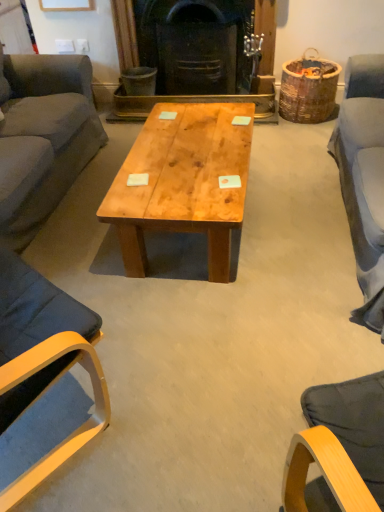
What do you see at coordinates (183, 182) in the screenshot? This screenshot has height=512, width=384. I see `natural wood coffee table at center` at bounding box center [183, 182].

You are a GUI agent. You are given a task and a screenshot of the screen. Output one action in this format:
    pyautogui.click(x=<x>, y=<y>)
    Task: Click on the dark gray fabric couch at left
    
    Given the screenshot: What is the action you would take?
    pyautogui.click(x=43, y=139)

Where is `matte wood chair at left`? The image size is (384, 512). matte wood chair at left is located at coordinates (43, 359).

What is the approximate height of black cast iron fireplace at center?

The height of black cast iron fireplace at center is 32.20 inches.

Identify the location of natural wood coffee table at center. (183, 182).

From the image's perspective, which object appears higher, matte wood chair at left or black cast iron fireplace at center?

black cast iron fireplace at center.

Which is in front, point (95, 370) or point (115, 110)?

The point (95, 370) is in front.

From their relative heights in the image, would you say matte wood chair at left is taller or shorter than black cast iron fireplace at center?

In the image, matte wood chair at left appears to be taller than black cast iron fireplace at center.

Is matte wood chair at left to the left or to the right of black cast iron fireplace at center in the image?

Based on their positions, matte wood chair at left is located to the left of black cast iron fireplace at center.

Can you see natural wood coffee table at center touching matte wood chair at left?

No, natural wood coffee table at center is not making contact with matte wood chair at left.

Does natural wood coffee table at center have a greater height compared to matte wood chair at left?

No, natural wood coffee table at center is not taller than matte wood chair at left.

Considering the sizes of objects natural wood coffee table at center and matte wood chair at left in the image provided, who is thinner, natural wood coffee table at center or matte wood chair at left?

matte wood chair at left is thinner.

Which object is positioned more to the right, matte wood chair at left or natural wood coffee table at center?

natural wood coffee table at center.

Is matte wood chair at left positioned with its back to natural wood coffee table at center?

No.

From the image's perspective, is matte wood chair at left on top of natural wood coffee table at center?

No, from the image's perspective, matte wood chair at left is not on top of natural wood coffee table at center.

Based on the photo, is matte wood chair at left beside natural wood coffee table at center?

No, matte wood chair at left is not making contact with natural wood coffee table at center.

Who is smaller, natural wood coffee table at center or black cast iron fireplace at center?

With smaller size is black cast iron fireplace at center.

From a real-world perspective, which object stands above the other?

black cast iron fireplace at center is physically above.

How much distance is there between natural wood coffee table at center and black cast iron fireplace at center?

natural wood coffee table at center and black cast iron fireplace at center are 4.10 feet apart.

Is natural wood coffee table at center to the right of black cast iron fireplace at center from the viewer's perspective?

No.

From the picture: From a real-world perspective, who is located lower, dark gray fabric couch at left or black cast iron fireplace at center?

black cast iron fireplace at center.

Considering the relative sizes of dark gray fabric couch at left and black cast iron fireplace at center in the image provided, is dark gray fabric couch at left taller than black cast iron fireplace at center?

Indeed, dark gray fabric couch at left has a greater height compared to black cast iron fireplace at center.

Considering the relative positions of dark gray fabric couch at left and black cast iron fireplace at center in the image provided, is dark gray fabric couch at left to the left of black cast iron fireplace at center from the viewer's perspective?

Yes.

Could you tell me if dark gray fabric couch at left is facing natural wood coffee table at center?

Yes.

Is the position of dark gray fabric couch at left more distant than that of natural wood coffee table at center?

No, dark gray fabric couch at left is closer to the viewer.

Is point (65, 72) positioned after point (224, 243)?

Yes.

Considering the relative sizes of dark gray fabric couch at left and natural wood coffee table at center in the image provided, is dark gray fabric couch at left wider than natural wood coffee table at center?

Indeed, dark gray fabric couch at left has a greater width compared to natural wood coffee table at center.

In the scene shown: Considering the relative sizes of matte wood chair at left and dark gray fabric couch at left in the image provided, is matte wood chair at left bigger than dark gray fabric couch at left?

Incorrect, matte wood chair at left is not larger than dark gray fabric couch at left.

From a real-world perspective, between matte wood chair at left and dark gray fabric couch at left, who is vertically higher?

From a 3D spatial view, matte wood chair at left is above.

Is matte wood chair at left oriented away from dark gray fabric couch at left?

No, matte wood chair at left is not facing the opposite direction of dark gray fabric couch at left.

Find the location of a particular element. chair that appears above the black cast iron fireplace at center (from a real-world perspective) is located at coordinates (43, 359).

Find the location of a particular element. coffee table lying above the matte wood chair at left (from the image's perspective) is located at coordinates (183, 182).

Considering their positions, is dark gray fabric couch at left positioned further to natural wood coffee table at center than matte wood chair at left?

Based on the image, matte wood chair at left appears to be further to natural wood coffee table at center.

Which object lies further to the anchor point dark gray fabric couch at left, natural wood coffee table at center or black cast iron fireplace at center?

black cast iron fireplace at center is further to dark gray fabric couch at left.

Estimate the real-world distances between objects in this image. Which object is further from natural wood coffee table at center, matte wood chair at left or dark gray fabric couch at left?

matte wood chair at left lies further to natural wood coffee table at center than the other object.

When comparing their distances from black cast iron fireplace at center, does natural wood coffee table at center or matte wood chair at left seem closer?

natural wood coffee table at center lies closer to black cast iron fireplace at center than the other object.

When comparing their distances from dark gray fabric couch at left, does black cast iron fireplace at center or natural wood coffee table at center seem further?

Among the two, black cast iron fireplace at center is located further to dark gray fabric couch at left.

From the image, which object appears to be nearer to matte wood chair at left, black cast iron fireplace at center or natural wood coffee table at center?

natural wood coffee table at center lies closer to matte wood chair at left than the other object.

From the image, which object appears to be nearer to natural wood coffee table at center, matte wood chair at left or black cast iron fireplace at center?

matte wood chair at left lies closer to natural wood coffee table at center than the other object.

Estimate the real-world distances between objects in this image. Which object is further from dark gray fabric couch at left, natural wood coffee table at center or matte wood chair at left?

Based on the image, matte wood chair at left appears to be further to dark gray fabric couch at left.

Find the location of `studio couch between matte wood chair at left and black cast iron fireplace at center along the z-axis`. studio couch between matte wood chair at left and black cast iron fireplace at center along the z-axis is located at coordinates (43, 139).

Where is `coffee table positioned between matte wood chair at left and black cast iron fireplace at center from near to far`? The width and height of the screenshot is (384, 512). coffee table positioned between matte wood chair at left and black cast iron fireplace at center from near to far is located at coordinates (183, 182).

This screenshot has height=512, width=384. I want to click on coffee table located between dark gray fabric couch at left and black cast iron fireplace at center in the depth direction, so click(183, 182).

Where is `chair between dark gray fabric couch at left and natural wood coffee table at center in the horizontal direction`? The height and width of the screenshot is (512, 384). chair between dark gray fabric couch at left and natural wood coffee table at center in the horizontal direction is located at coordinates (43, 359).